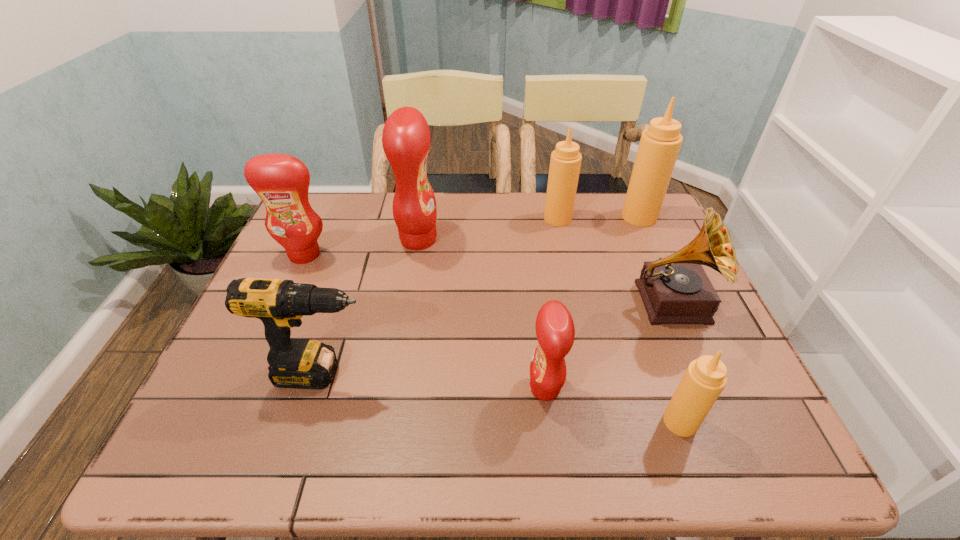
Choose which tan condiment is the nearest neighbor to the drill. Please provide its 2D coordinates. Your answer should be formatted as a tuple, i.e. [(x, y)], where the tuple contains the x and y coordinates of a point satisfying the conditions above.

[(705, 378)]

You are a GUI agent. You are given a task and a screenshot of the screen. Output one action in this format:
    pyautogui.click(x=<x>, y=<y>)
    Task: Click on the vacant space that satisfies the following two spatial constraints: 1. on the front side of the third condiment from right to left; 2. on the right side of the second tan condiment from left to right
    The height and width of the screenshot is (540, 960).
    Given the screenshot: What is the action you would take?
    pyautogui.click(x=602, y=422)